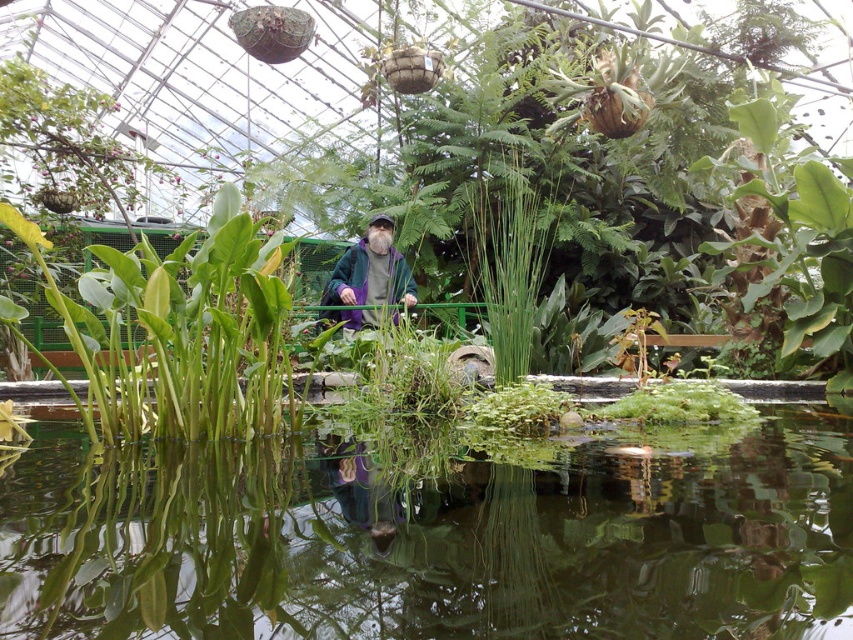
In the scene shown: You are a visitor in the greenhouse and want to take a photo of the transparent water at center and the green leafy plant at center. Can you fit both objects in your camera frame at the same time?

The transparent water at center and green leafy plant at center are 1.08 meters apart, so yes, both objects can fit in the camera frame since the distance between them is relatively small.

You are standing on the pathway in the greenhouse and see the point marked at coordinates (433, 540). What is located at that point?

The point at (433, 540) indicates transparent water at center.

You are standing in the greenhouse and want to take a photo of both the transparent water at center and the green leafy plant at center. Which object should you focus on first if you want to capture both in a single frame without moving the camera?

You should focus on the green leafy plant at center first because it is larger than the transparent water at center, allowing it to be more prominently featured in the frame while still including the smaller transparent water at center.